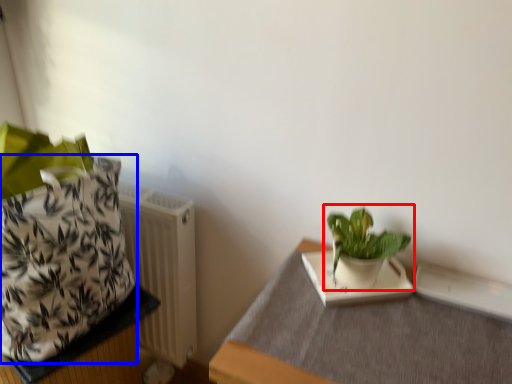
Question: Which object appears closest to the camera in this image, houseplant (highlighted by a red box) or flowerpot (highlighted by a blue box)?

Choices:
 (A) houseplant
 (B) flowerpot

Answer: (B)